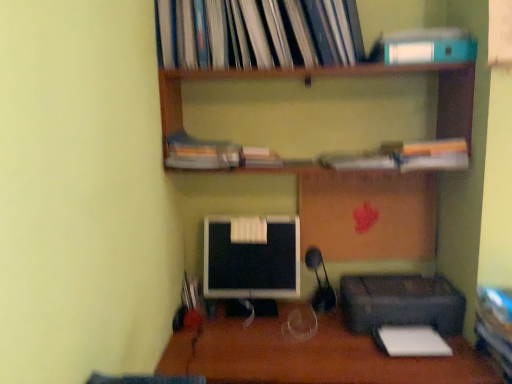
This screenshot has width=512, height=384. Describe the element at coordinates (311, 355) in the screenshot. I see `wooden desk at center` at that location.

Describe the element at coordinates (252, 259) in the screenshot. The height and width of the screenshot is (384, 512). I see `black glossy monitor at center` at that location.

The image size is (512, 384). Describe the element at coordinates (359, 161) in the screenshot. I see `hardcover book at center, the 1th book in the bottom-to-top sequence` at that location.

What is the approximate width of hardcover books at upper center, placed as the 1th book when sorted from top to bottom?

It is 28.32 centimeters.

This screenshot has width=512, height=384. I want to click on teal matte paperback book at upper right, so click(429, 46).

Where is `matte plastic book at center, which ranks as the second book in bottom-to-top order`? This screenshot has width=512, height=384. matte plastic book at center, which ranks as the second book in bottom-to-top order is located at coordinates (260, 158).

Locate an element on the screen. This screenshot has width=512, height=384. wooden desk at center is located at coordinates (311, 355).

Is teal matte paperback book at upper right to the left of matte plastic book at center, which ranks as the second book in bottom-to-top order, from the viewer's perspective?

No, teal matte paperback book at upper right is not to the left of matte plastic book at center, which ranks as the second book in bottom-to-top order.

Does teal matte paperback book at upper right contain matte plastic book at center, which ranks as the second book in bottom-to-top order?

That's incorrect, matte plastic book at center, which ranks as the second book in bottom-to-top order, is not inside teal matte paperback book at upper right.

Considering the sizes of teal matte paperback book at upper right and matte plastic book at center, the third book from the top, in the image, is teal matte paperback book at upper right taller or shorter than matte plastic book at center, the third book from the top,?

Considering their sizes, teal matte paperback book at upper right has more height than matte plastic book at center, the third book from the top.

At what (x,y) coordinates should I click in order to perform the action: click on paperback book that appears above the matte plastic book at center, which ranks as the second book in bottom-to-top order (from the image's perspective). Please return your answer as a coordinate pair (x, y). Looking at the image, I should click on (429, 46).

Considering the positions of objects black plastic printer at lower right and wooden desk at center in the image provided, who is more to the left, black plastic printer at lower right or wooden desk at center?

wooden desk at center.

Does black plastic printer at lower right contain wooden desk at center?

Definitely not — wooden desk at center is not inside black plastic printer at lower right.

From the picture: How different are the orientations of black plastic printer at lower right and wooden desk at center in degrees?

black plastic printer at lower right and wooden desk at center are facing 0.408 degrees away from each other.

From a real-world perspective, between hardcover books at upper center, marked as the 4th book in a bottom-to-top arrangement, and black glossy monitor at center, who is vertically lower?

black glossy monitor at center is physically lower.

Locate an element on the screen. Image resolution: width=512 pixels, height=384 pixels. the 4th book above the black glossy monitor at center (from a real-world perspective) is located at coordinates (193, 34).

Which object is positioned more to the right, hardcover books at upper center, marked as the 4th book in a bottom-to-top arrangement, or black glossy monitor at center?

Positioned to the right is hardcover books at upper center, marked as the 4th book in a bottom-to-top arrangement.

Is black glossy monitor at center completely or partially inside hardcover books at upper center, marked as the 4th book in a bottom-to-top arrangement?

No, hardcover books at upper center, marked as the 4th book in a bottom-to-top arrangement, does not contain black glossy monitor at center.

You are a GUI agent. You are given a task and a screenshot of the screen. Output one action in this format:
    pyautogui.click(x=<x>, y=<y>)
    Task: Click on the notepad lying above the wooden desk at center (from the image's perspective)
    The height and width of the screenshot is (384, 512).
    Given the screenshot: What is the action you would take?
    pyautogui.click(x=413, y=341)

Does wooden desk at center turn towards white paper at lower right?

No.

Is wooden desk at center far away from white paper at lower right?

Actually, wooden desk at center and white paper at lower right are a little close together.

How many degrees apart are the facing directions of wooden desk at center and white paper at lower right?

0.408 degrees separate the facing orientations of wooden desk at center and white paper at lower right.

Are teal matte paperback book at upper right and hardcover book at center, which is the fourth book in top-to-bottom order, far apart?

teal matte paperback book at upper right is actually quite close to hardcover book at center, which is the fourth book in top-to-bottom order.

Which is closer to the camera, [388,45] or [371,165]?

Point [388,45] is closer to the camera than point [371,165].

Which book is the 1st one when counting from the left side of the teal matte paperback book at upper right? Please provide its 2D coordinates.

[(359, 161)]

Consider the image. How much distance is there between teal matte paperback book at upper right and hardcover book at center, the 1th book in the bottom-to-top sequence?

A distance of 15.41 inches exists between teal matte paperback book at upper right and hardcover book at center, the 1th book in the bottom-to-top sequence.

In the scene shown: From a real-world perspective, relative to black plastic printer at lower right, is matte plastic book at center, which ranks as the second book in bottom-to-top order, vertically above or below?

matte plastic book at center, which ranks as the second book in bottom-to-top order, is situated higher than black plastic printer at lower right in the real world.

From the image's perspective, which object appears higher, matte plastic book at center, which ranks as the second book in bottom-to-top order, or black plastic printer at lower right?

From the image's view, matte plastic book at center, which ranks as the second book in bottom-to-top order, is above.

Can you confirm if matte plastic book at center, which ranks as the second book in bottom-to-top order, is positioned to the left of black plastic printer at lower right?

Yes, matte plastic book at center, which ranks as the second book in bottom-to-top order, is to the left of black plastic printer at lower right.

Can you tell me how much matte plastic book at center, the third book from the top, and black plastic printer at lower right differ in facing direction?

There is a 0.784-degree angle between the facing directions of matte plastic book at center, the third book from the top, and black plastic printer at lower right.

Which object is positioned more to the right, hardcover books at upper center, marked as the 4th book in a bottom-to-top arrangement, or matte plastic book at center, which ranks as the second book in bottom-to-top order?

hardcover books at upper center, marked as the 4th book in a bottom-to-top arrangement.

Is hardcover books at upper center, marked as the 4th book in a bottom-to-top arrangement, outside of matte plastic book at center, which ranks as the second book in bottom-to-top order?

Indeed, hardcover books at upper center, marked as the 4th book in a bottom-to-top arrangement, is completely outside matte plastic book at center, which ranks as the second book in bottom-to-top order.

Is hardcover books at upper center, marked as the 4th book in a bottom-to-top arrangement, not near matte plastic book at center, which ranks as the second book in bottom-to-top order?

hardcover books at upper center, marked as the 4th book in a bottom-to-top arrangement, is actually quite close to matte plastic book at center, which ranks as the second book in bottom-to-top order.

Is hardcover books at upper center, placed as the 1th book when sorted from top to bottom, taller or shorter than matte plastic book at center, which ranks as the second book in bottom-to-top order?

Clearly, hardcover books at upper center, placed as the 1th book when sorted from top to bottom, is taller compared to matte plastic book at center, which ranks as the second book in bottom-to-top order.

Starting from the teal matte paperback book at upper right, which book is the 4th one behind? Please provide its 2D coordinates.

[(260, 158)]

The image size is (512, 384). Identify the location of desk below the black plastic printer at lower right (from a real-world perspective). (311, 355).

When comparing their distances from hardcover book at upper center, which is the 2th book from top to bottom, does white paper at lower right or black glossy monitor at center seem further?

white paper at lower right is further to hardcover book at upper center, which is the 2th book from top to bottom.

When comparing their distances from wooden desk at center, does hardcover books at upper center, marked as the 4th book in a bottom-to-top arrangement, or black plastic printer at lower right seem further?

hardcover books at upper center, marked as the 4th book in a bottom-to-top arrangement, is positioned further to the anchor wooden desk at center.

When comparing their distances from black glossy monitor at center, does teal matte paperback book at upper right or matte plastic book at center, which ranks as the second book in bottom-to-top order, seem closer?

Among the two, matte plastic book at center, which ranks as the second book in bottom-to-top order, is located nearer to black glossy monitor at center.

From the picture: Looking at the image, which one is located further to hardcover books at upper center, placed as the 1th book when sorted from top to bottom, matte plastic book at center, the third book from the top, or teal matte paperback book at upper right?

Among the two, matte plastic book at center, the third book from the top, is located further to hardcover books at upper center, placed as the 1th book when sorted from top to bottom.

Looking at the image, which one is located closer to hardcover book at center, which is the fourth book in top-to-bottom order, black plastic printer at lower right or matte plastic book at center, the third book from the top?

matte plastic book at center, the third book from the top.

Estimate the real-world distances between objects in this image. Which object is further from black glossy monitor at center, matte plastic book at center, the third book from the top, or black plastic printer at lower right?

matte plastic book at center, the third book from the top, is further to black glossy monitor at center.

When comparing their distances from black glossy monitor at center, does hardcover books at upper center, placed as the 1th book when sorted from top to bottom, or hardcover book at center, the 1th book in the bottom-to-top sequence, seem further?

hardcover books at upper center, placed as the 1th book when sorted from top to bottom, is positioned further to the anchor black glossy monitor at center.

When comparing their distances from black glossy monitor at center, does hardcover book at upper center, which is the 2th book from top to bottom, or hardcover books at upper center, marked as the 4th book in a bottom-to-top arrangement, seem closer?

The object closer to black glossy monitor at center is hardcover book at upper center, which is the 2th book from top to bottom.

Find the location of `shelf between hardcover books at upper center, marked as the 4th book in a bottom-to-top arrangement, and black plastic printer at lower right from top to bottom`. shelf between hardcover books at upper center, marked as the 4th book in a bottom-to-top arrangement, and black plastic printer at lower right from top to bottom is located at coordinates (283, 42).

Where is `notepad between teal matte paperback book at upper right and wooden desk at center vertically`? This screenshot has width=512, height=384. notepad between teal matte paperback book at upper right and wooden desk at center vertically is located at coordinates point(413,341).

Find the location of a particular element. The image size is (512, 384). shelf between hardcover books at upper center, placed as the 1th book when sorted from top to bottom, and hardcover book at upper center, the 3th book in the bottom-to-top sequence, in the up-down direction is located at coordinates (283, 42).

You are a GUI agent. You are given a task and a screenshot of the screen. Output one action in this format:
    pyautogui.click(x=<x>, y=<y>)
    Task: Click on the computer monitor between hardcover books at upper center, marked as the 4th book in a bottom-to-top arrangement, and black plastic printer at lower right in the up-down direction
    
    Given the screenshot: What is the action you would take?
    pyautogui.click(x=252, y=259)